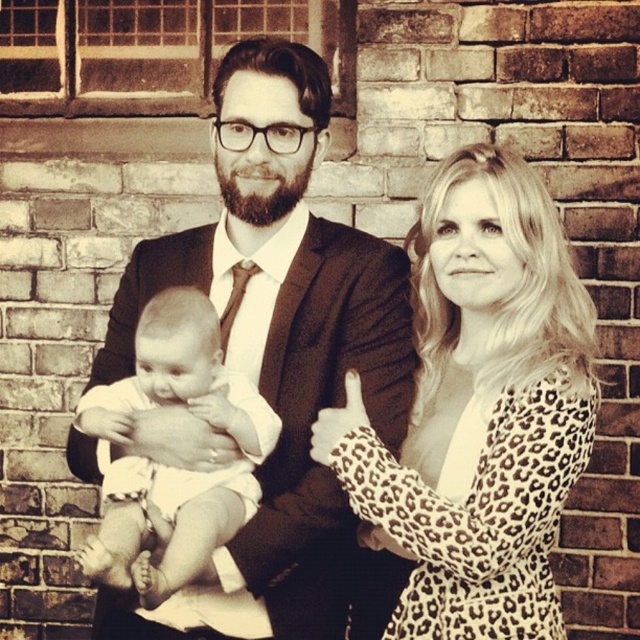
You are a photographer standing 1.5 meters away from the camera. You want to adjust the focus on the black suit at center. Can you reach the camera from your current position?

The black suit at center and camera are 1.93 meters apart. Since you are 1.5 meters away from the camera, you are 1.5 meters away from the camera, so the total distance between you and the black suit at center would be 1.5 meters plus 1.93 meters, which is 3.43 meters. Therefore, you cannot reach the camera to adjust the focus on the black suit at center from your current position.

You are a photographer setting up a photo shoot and want to ensure that both the leopard print dress at center and the white clothed baby at center are clearly visible in the frame. Given their sizes, which object should you focus on first to ensure proper framing?

The leopard print dress at center is larger in size than the white clothed baby at center, so you should focus on the leopard print dress at center first to ensure it fits well within the frame before adjusting for the smaller object.